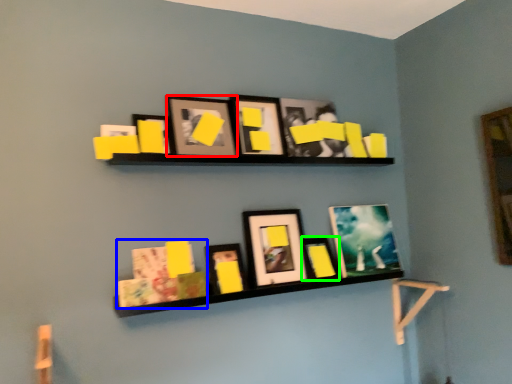
Question: Based on their relative distances, which object is nearer to picture frame (highlighted by a red box)? Choose from book (highlighted by a blue box) and picture frame (highlighted by a green box).

Choices:
 (A) book
 (B) picture frame

Answer: (A)